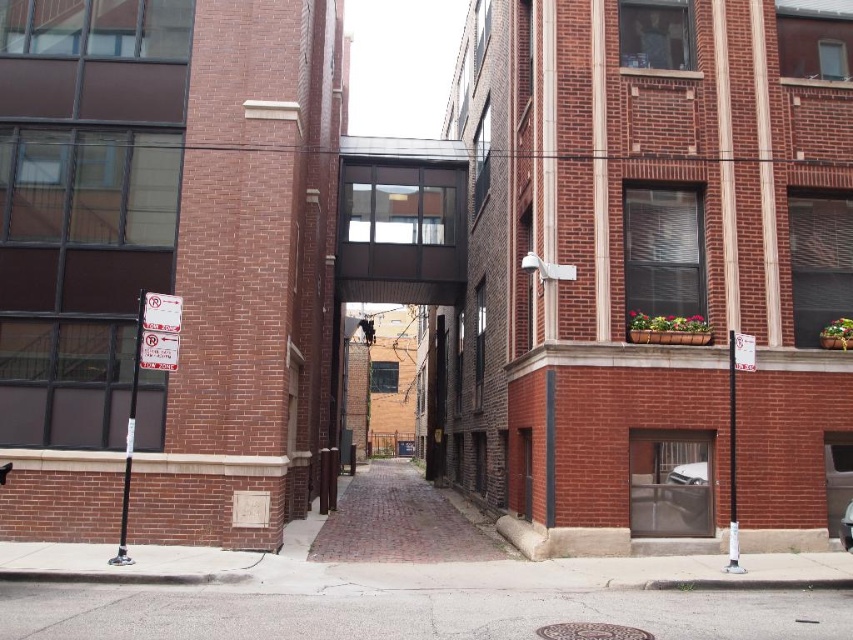
Does brick pavement at center appear over metallic silver car at center?

Actually, brick pavement at center is below metallic silver car at center.

Does brick pavement at center have a greater width compared to metallic silver car at center?

Indeed, brick pavement at center has a greater width compared to metallic silver car at center.

This screenshot has height=640, width=853. Identify the location of brick pavement at center. coord(402,522).

Who is more distant from viewer, (x=221, y=593) or (x=701, y=468)?

Positioned behind is point (x=701, y=468).

Based on the photo, does gray asphalt at lower center have a smaller size compared to white glossy car at center?

No, gray asphalt at lower center is not smaller than white glossy car at center.

The height and width of the screenshot is (640, 853). I want to click on gray asphalt at lower center, so click(409, 612).

Is gray asphalt at lower center below metallic silver car at center?

Indeed, gray asphalt at lower center is positioned under metallic silver car at center.

The image size is (853, 640). In order to click on gray asphalt at lower center in this screenshot , I will do `click(409, 612)`.

Does point (19, 621) come closer to viewer compared to point (848, 548)?

Yes, point (19, 621) is in front of point (848, 548).

Find the location of `gray asphalt at lower center`. gray asphalt at lower center is located at coordinates (409, 612).